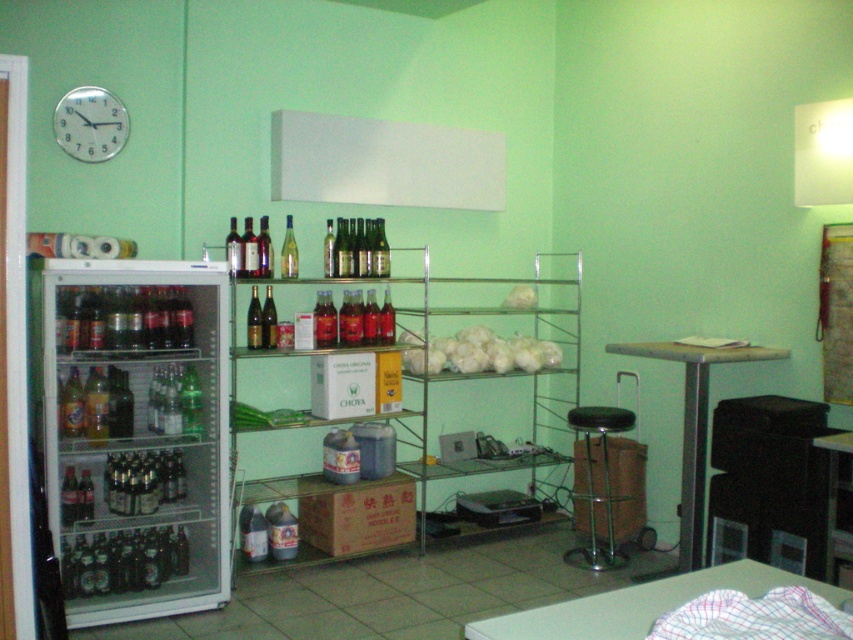
Question: From the image, what is the correct spatial relationship of clear glass refrigerator at left in relation to green glass wine at center?

Choices:
 (A) left
 (B) right

Answer: (A)

Question: Which of these objects is positioned closest to the black metal stool at center?

Choices:
 (A) green glass bottles at left
 (B) green glass bottle at center

Answer: (B)

Question: Which point appears closest to the camera in this image?

Choices:
 (A) (283, 256)
 (B) (361, 221)

Answer: (A)

Question: Can you confirm if black metal stool at center is positioned to the left of translucent glass bottle at lower left?

Choices:
 (A) no
 (B) yes

Answer: (A)

Question: Does white translucent onions at center appear over green glass wine at center?

Choices:
 (A) no
 (B) yes

Answer: (A)

Question: Which point is closer to the camera taking this photo?

Choices:
 (A) (341, 266)
 (B) (88, 161)

Answer: (B)